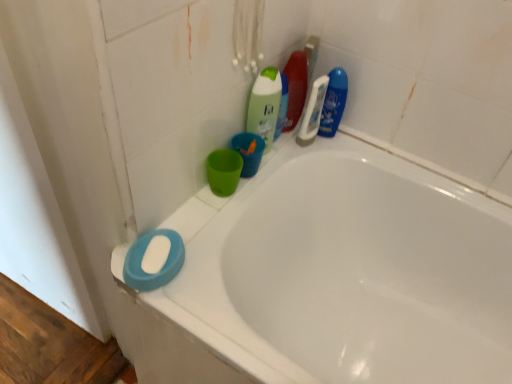
Locate an element on the screen. Image resolution: width=512 pixels, height=384 pixels. free spot in front of translucent plastic bottle at upper center, which is counted as the second cleaning product, starting from the left is located at coordinates (282, 152).